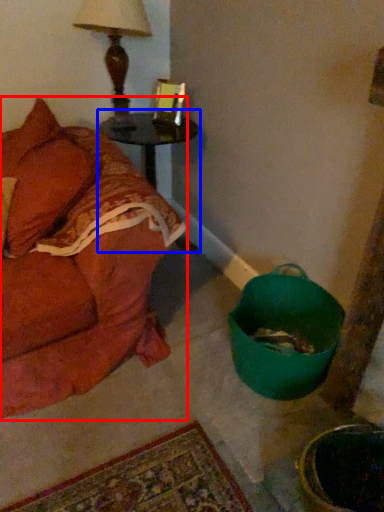
Question: Which object appears farthest to the camera in this image, studio couch (highlighted by a red box) or table (highlighted by a blue box)?

Choices:
 (A) studio couch
 (B) table

Answer: (B)